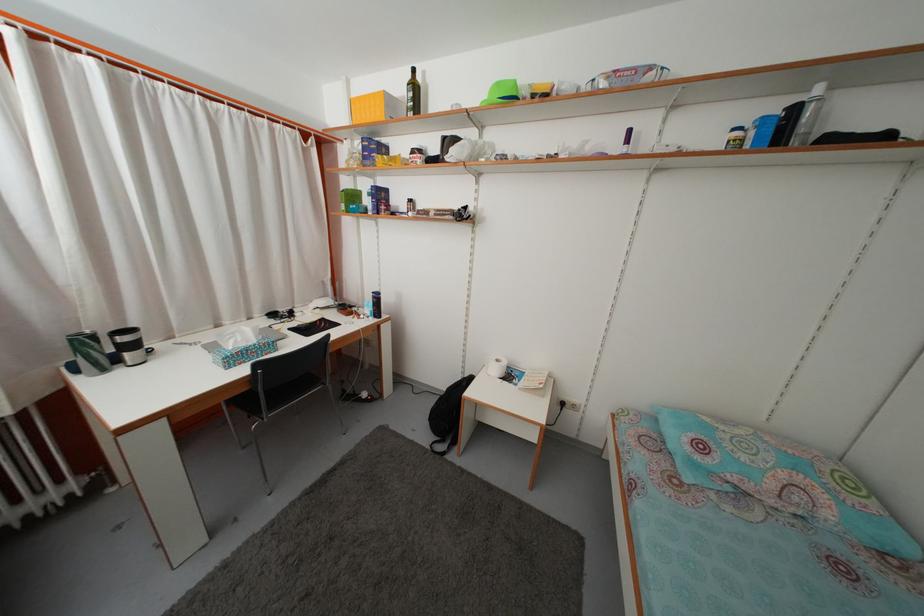
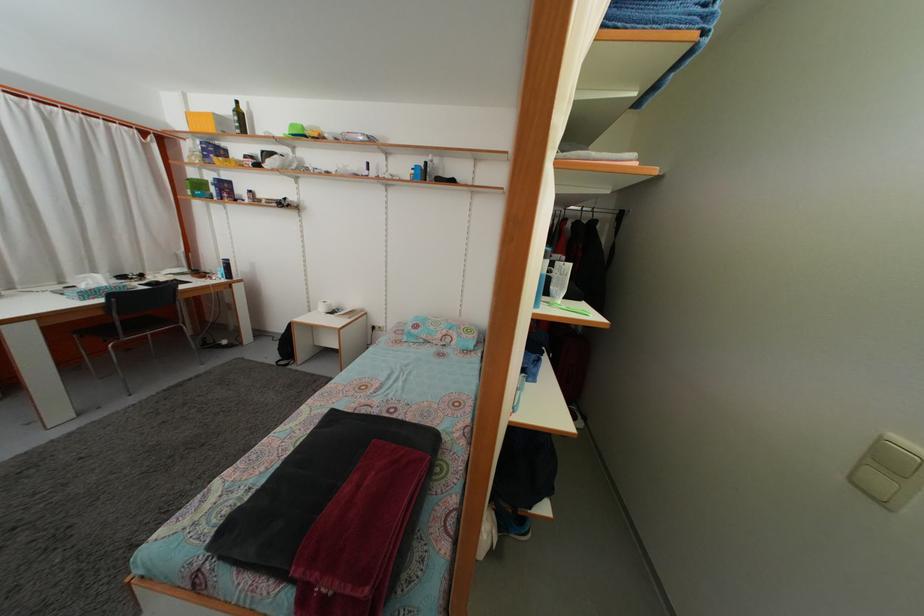
The point at [504,92] is marked in the first image. Where is the corresponding point in the second image?

(298, 132)